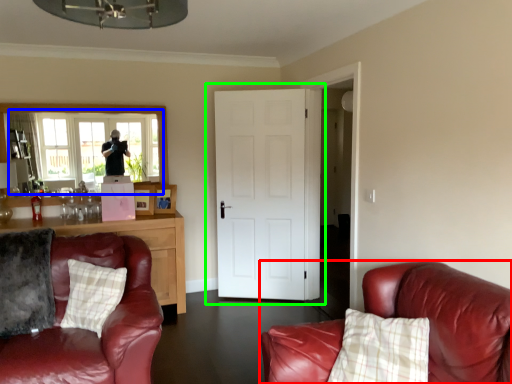
Question: Which object is the farthest from studio couch (highlighted by a red box)? Choose among these: window (highlighted by a blue box) or door (highlighted by a green box).

Choices:
 (A) window
 (B) door

Answer: (A)